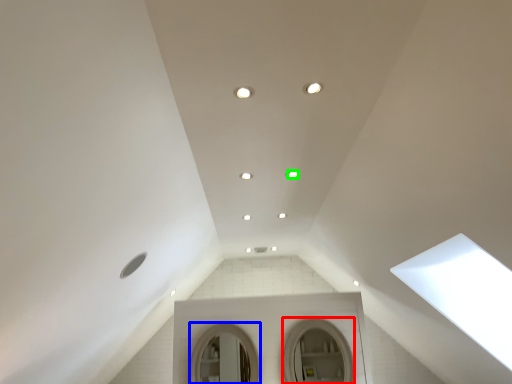
Question: Considering the real-world distances, which object is farthest from mirror (highlighted by a red box)? mirror (highlighted by a blue box) or lighting (highlighted by a green box)?

Choices:
 (A) mirror
 (B) lighting

Answer: (B)